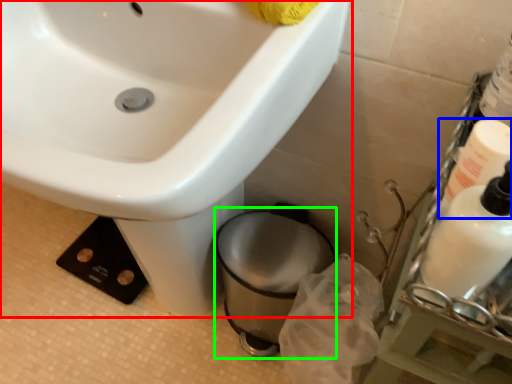
Question: Which is farther away from sink (highlighted by a red box)? cleaning product (highlighted by a blue box) or toilet bowl (highlighted by a green box)?

Choices:
 (A) cleaning product
 (B) toilet bowl

Answer: (A)